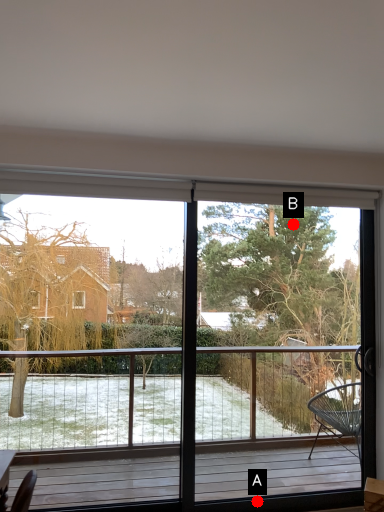
Question: Two points are circled on the image, labeled by A and B beside each circle. Which point is closer to the camera?

Choices:
 (A) A is closer
 (B) B is closer

Answer: (A)